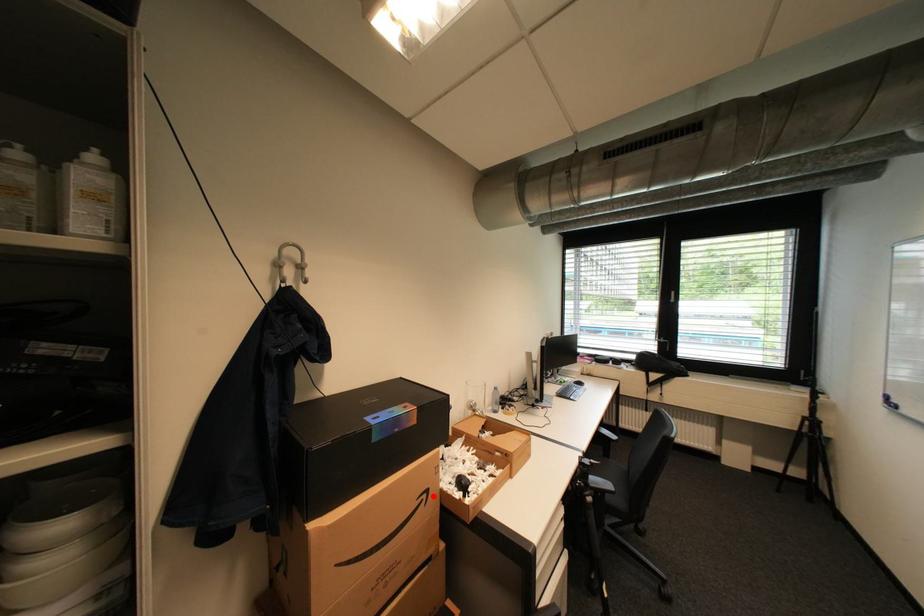
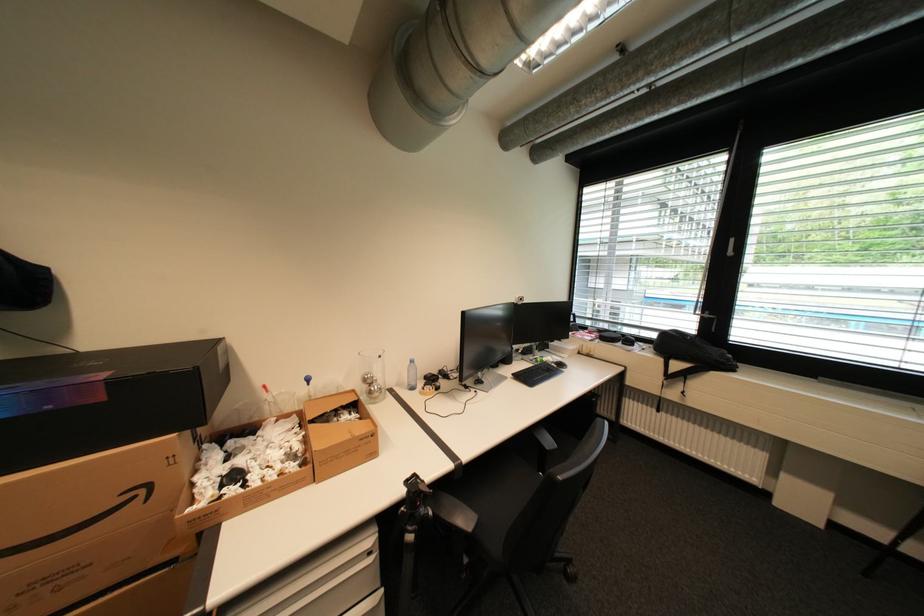
Where in the second image is the point corresponding to the highlighted location from the first image?

(151, 491)